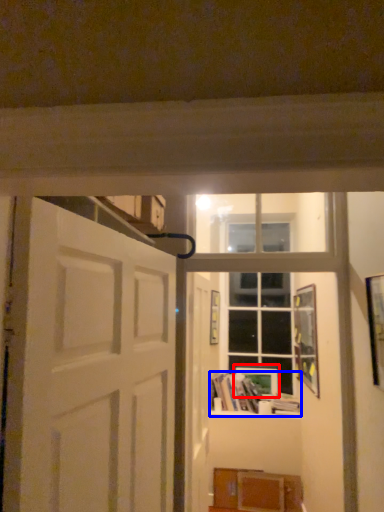
Question: Which object appears closest to the camera in this image, picture frame (highlighted by a red box) or book (highlighted by a blue box)?

Choices:
 (A) picture frame
 (B) book

Answer: (B)